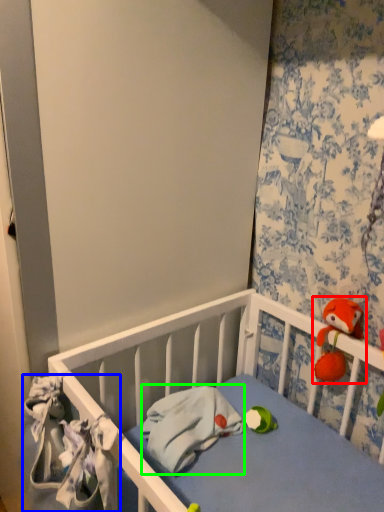
Question: Estimate the real-world distances between objects in this image. Which object is farther from toy (highlighted by a red box), material (highlighted by a blue box) or material (highlighted by a green box)?

Choices:
 (A) material
 (B) material

Answer: (A)